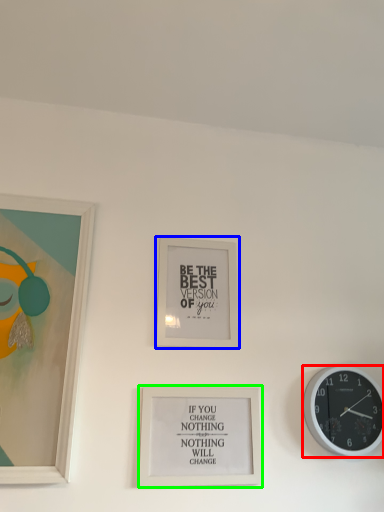
Question: Considering the real-world distances, which object is closest to wall clock (highlighted by a red box)? picture frame (highlighted by a blue box) or picture frame (highlighted by a green box).

Choices:
 (A) picture frame
 (B) picture frame

Answer: (B)